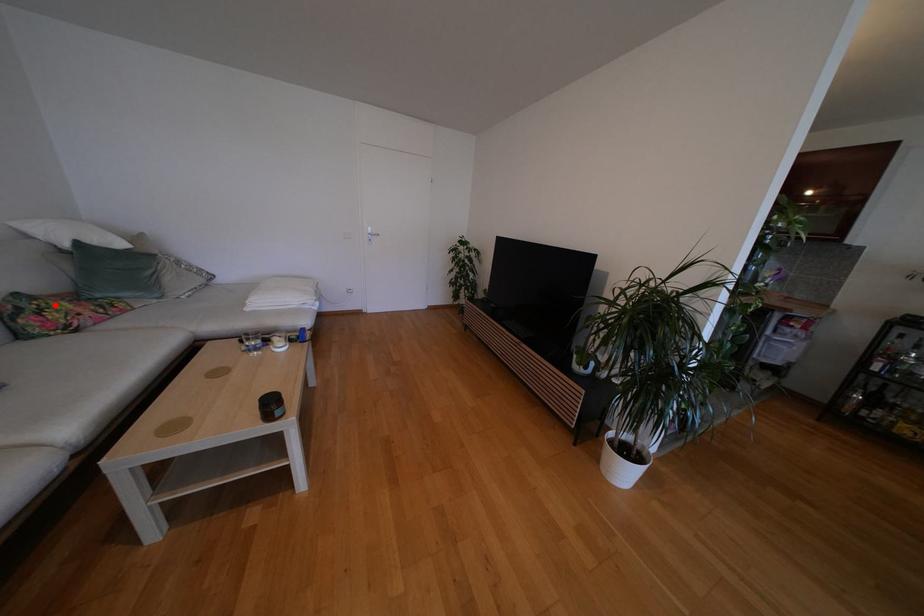
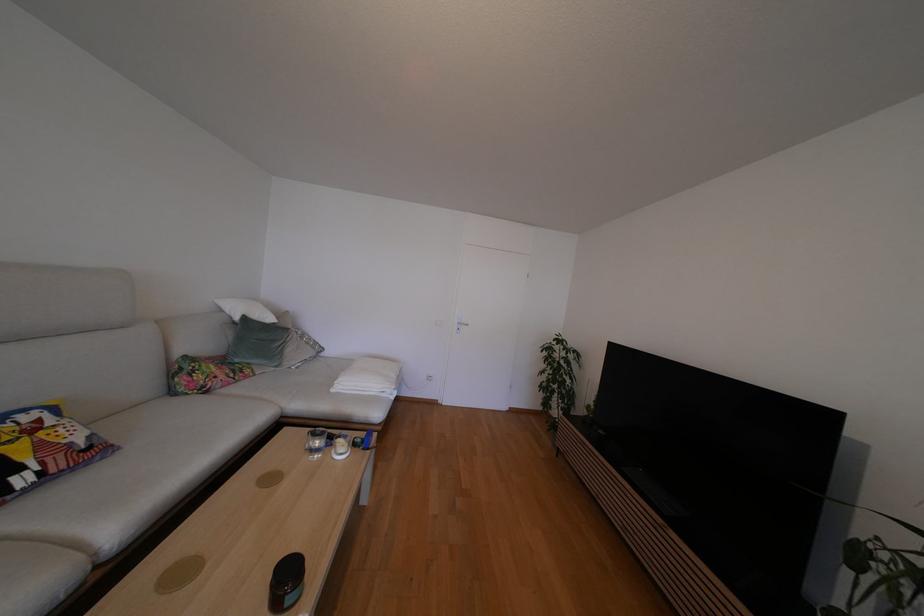
Question: I am providing you with two images of the same scene from different viewpoints. Given a red point in image1, look at the same physical point in image2. Is it:

Choices:
 (A) Closer to the viewpoint
 (B) Farther from the viewpoint

Answer: (A)